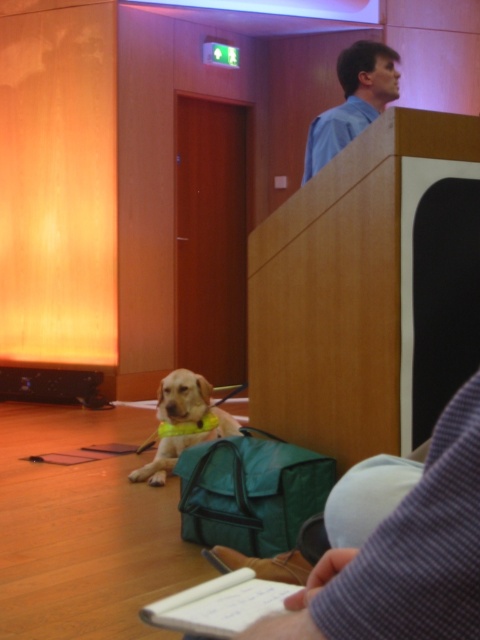
Between green fabric bag at lower center and yellow fabric dog at lower left, which one appears on the right side from the viewer's perspective?

From the viewer's perspective, green fabric bag at lower center appears more on the right side.

Is point (259, 536) closer to viewer compared to point (188, 381)?

Yes, it is in front of point (188, 381).

Which is behind, point (287, 500) or point (195, 433)?

Point (195, 433)

This screenshot has width=480, height=640. I want to click on green fabric bag at lower center, so click(251, 492).

Who is positioned more to the left, green fabric bag at lower center or blue shirt at upper center?

green fabric bag at lower center

Consider the image. Is green fabric bag at lower center below blue shirt at upper center?

Yes.

Measure the distance between green fabric bag at lower center and camera.

green fabric bag at lower center and camera are 2.89 meters apart from each other.

Where is `green fabric bag at lower center`? Image resolution: width=480 pixels, height=640 pixels. green fabric bag at lower center is located at coordinates (251, 492).

Who is higher up, blue shirt at upper center or yellow fabric dog at lower left?

blue shirt at upper center is higher up.

Is blue shirt at upper center bigger than yellow fabric dog at lower left?

Incorrect, blue shirt at upper center is not larger than yellow fabric dog at lower left.

Who is more distant from viewer, (x=321, y=166) or (x=178, y=397)?

Positioned behind is point (x=178, y=397).

Where is `blue shirt at upper center`? The height and width of the screenshot is (640, 480). blue shirt at upper center is located at coordinates (352, 100).